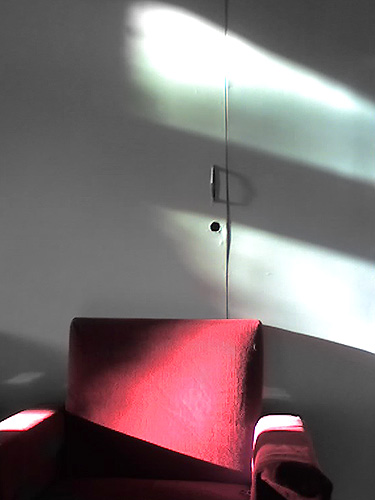
In order to click on armrest in this screenshot , I will do `click(287, 444)`, `click(21, 427)`.